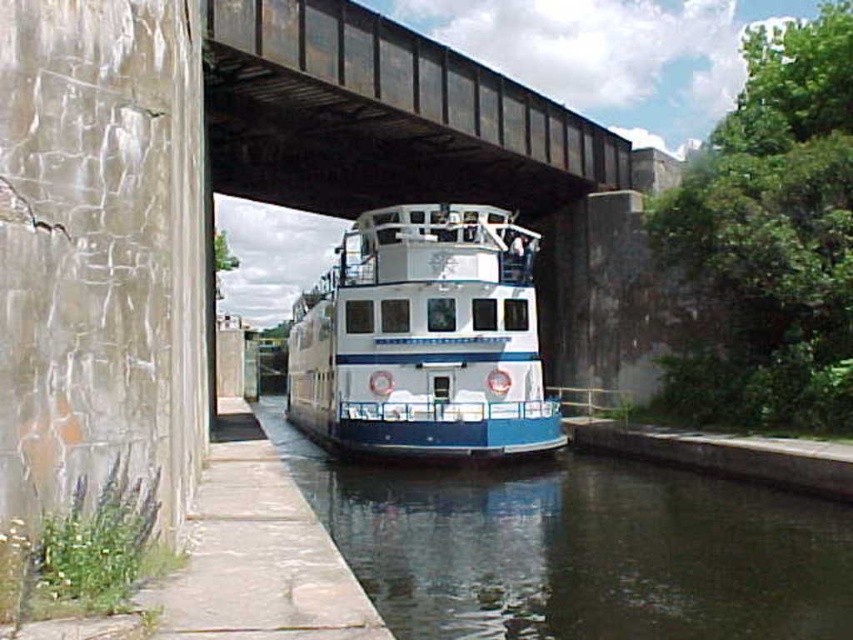
You are standing at the point with coordinates point [546,112] and want to reach the point with coordinates point [850,531]. Which direction should you move to get closer to your destination?

You should move forward because point [850,531] is in front of point [546,112].

You are a photographer planning to capture the white glossy boat at center and the smooth dark water at center in a single shot. Given that your camera can only focus on one object clearly, which object should you prioritize focusing on to ensure it appears larger in the photo?

The white glossy boat at center is larger than the smooth dark water at center, so you should prioritize focusing on the white glossy boat at center to ensure it appears larger in the photo.

You are a crane operator trying to lower a heavy load onto the white glossy boat at center. The metal bridge at upper center is in the way. Can you safely lower the load without hitting the bridge?

The metal bridge at upper center has a lesser height compared to white glossy boat at center, so the bridge is lower than the boat. Since the boat is higher, you can safely lower the load onto the white glossy boat at center without hitting the bridge.